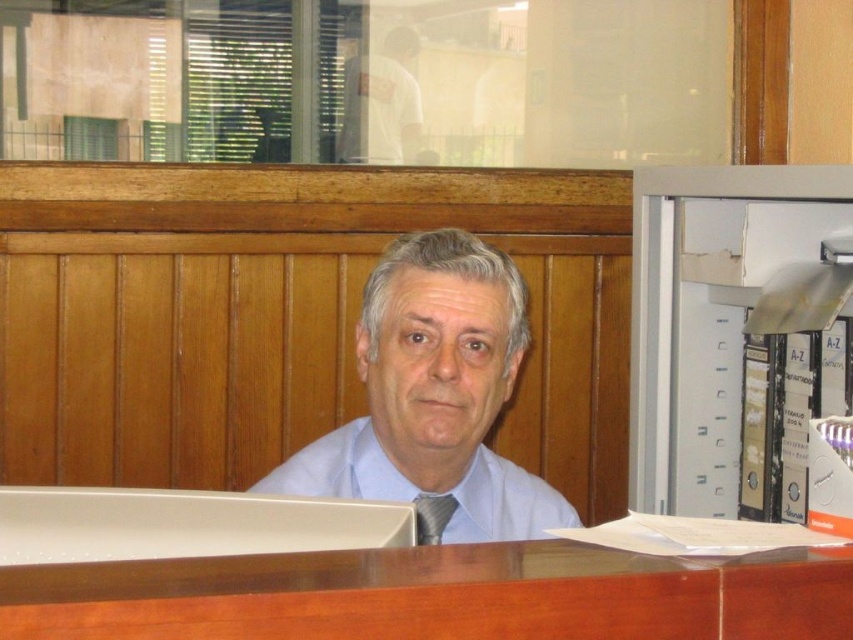
Question: Can you confirm if white plastic file cabinet at right is positioned to the left of light blue fabric dress shirt at center?

Choices:
 (A) yes
 (B) no

Answer: (B)

Question: Can you confirm if white plastic file cabinet at right is positioned above white cotton shirt at upper center?

Choices:
 (A) yes
 (B) no

Answer: (B)

Question: Which point is farther to the camera?

Choices:
 (A) (502, 515)
 (B) (390, 80)
 (C) (445, 513)

Answer: (B)

Question: Considering the relative positions of white plastic file cabinet at right and light blue fabric dress shirt at center in the image provided, where is white plastic file cabinet at right located with respect to light blue fabric dress shirt at center?

Choices:
 (A) left
 (B) right

Answer: (B)

Question: Among these objects, which one is nearest to the camera?

Choices:
 (A) matte black tie at center
 (B) light blue fabric shirt at center
 (C) white cotton shirt at upper center
 (D) light blue fabric dress shirt at center

Answer: (D)

Question: Which of these objects is positioned closest to the matte black tie at center?

Choices:
 (A) white cotton shirt at upper center
 (B) light blue fabric shirt at center
 (C) light blue fabric dress shirt at center

Answer: (C)